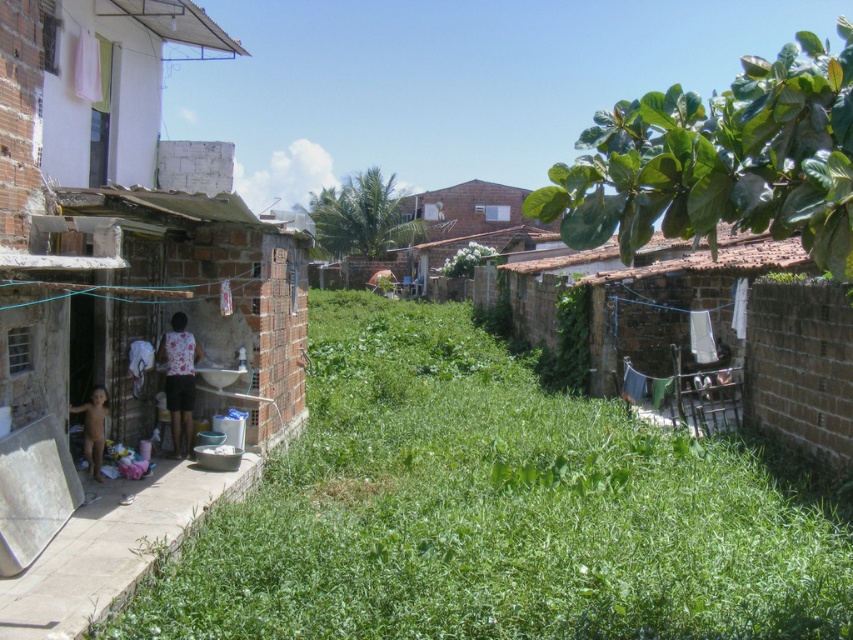
Which is more to the right, green leafy grass at lower left or white concrete alley at lower left?

green leafy grass at lower left is more to the right.

Find the location of `green leafy grass at lower left`. green leafy grass at lower left is located at coordinates (496, 509).

Does point (224, 593) come closer to viewer compared to point (36, 595)?

No.

Identify the location of green leafy grass at lower left. (496, 509).

Can you confirm if green leafy plant at upper right is wider than white concrete alley at lower left?

Yes, green leafy plant at upper right is wider than white concrete alley at lower left.

Can you confirm if green leafy plant at upper right is positioned to the left of white concrete alley at lower left?

Incorrect, green leafy plant at upper right is not on the left side of white concrete alley at lower left.

Which is in front, point (793, 186) or point (16, 586)?

Positioned in front is point (793, 186).

Find the location of `green leafy plant at upper right`. green leafy plant at upper right is located at coordinates (720, 161).

This screenshot has height=640, width=853. Find the location of `green leafy grass at lower left`. green leafy grass at lower left is located at coordinates coord(496,509).

Is point (483, 332) farther from viewer compared to point (173, 156)?

That is True.

At what (x,y) coordinates should I click in order to perform the action: click on green leafy grass at lower left. Please return your answer as a coordinate pair (x, y). The height and width of the screenshot is (640, 853). Looking at the image, I should click on (x=496, y=509).